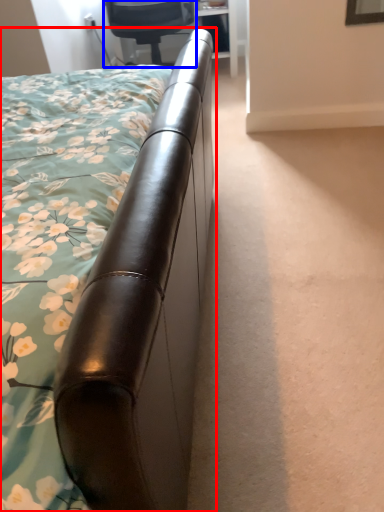
Question: Which point is closer to the camera, bed (highlighted by a red box) or chair (highlighted by a blue box)?

Choices:
 (A) bed
 (B) chair

Answer: (A)